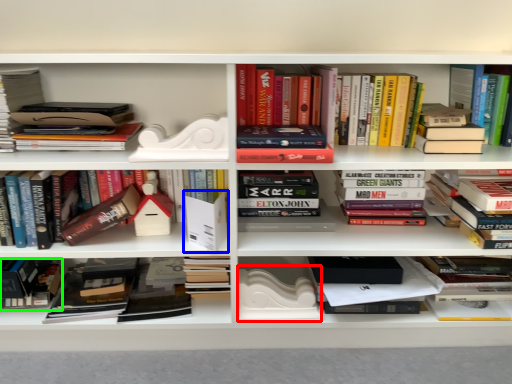
Question: Which is farther away from paperback book (highlighted by a red box)? paperback book (highlighted by a blue box) or book (highlighted by a green box)?

Choices:
 (A) paperback book
 (B) book

Answer: (B)